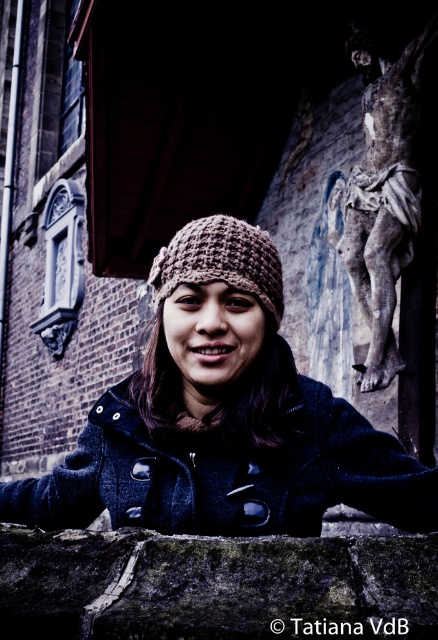
You are standing at the base of the brick wall in the image and want to reach a specific point marked at coordinates point (389, 83). If your maximum comfortable walking distance is 50 feet, can you comfortably walk to that point without needing assistance?

The distance of point (389, 83) from viewer is 49.87 feet, which is within your maximum comfortable walking distance of 50 feet. Therefore, you can comfortably walk to that point without needing assistance.

You are a photographer standing 10 meters away from the weathered stone crucifix at right. You want to take a photo of it but need to be within 10 meters to get a clear shot. Can you move closer?

The distance between you and the weathered stone crucifix at right is 14.47 meters, which is farther than the required 10 meters. You need to move 4.47 meters closer to be within range for a clear shot.

You are a photographer trying to capture the brown knitted beanie at center and the weathered stone crucifix at right in the same frame. Given that the beanie appears wider than the crucifix, which object should you zoom in on to ensure both fit in the frame without cropping?

Since the brown knitted beanie at center is wider than the weathered stone crucifix at right, you should zoom in on the crucifix to accommodate the beanie in the frame.